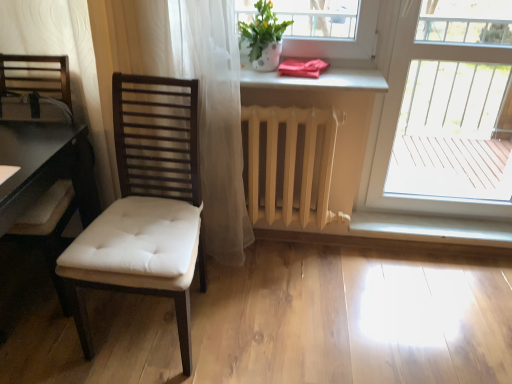
Question: Is white glossy window sill at lower center further to the viewer compared to white matte radiator at center?

Choices:
 (A) yes
 (B) no

Answer: (A)

Question: Can you confirm if white glossy window sill at lower center is positioned to the left of white matte radiator at center?

Choices:
 (A) yes
 (B) no

Answer: (B)

Question: Can we say white glossy window sill at lower center lies outside white matte radiator at center?

Choices:
 (A) no
 (B) yes

Answer: (B)

Question: From a real-world perspective, is white glossy window sill at lower center below white matte radiator at center?

Choices:
 (A) no
 (B) yes

Answer: (B)

Question: Does white glossy window sill at lower center have a greater height compared to white matte radiator at center?

Choices:
 (A) yes
 (B) no

Answer: (B)

Question: Considering the positions of transparent glass door at right and white glossy window sill at lower center in the image, is transparent glass door at right bigger or smaller than white glossy window sill at lower center?

Choices:
 (A) small
 (B) big

Answer: (B)

Question: Is transparent glass door at right inside the boundaries of white glossy window sill at lower center, or outside?

Choices:
 (A) inside
 (B) outside

Answer: (B)

Question: From a real-world perspective, is transparent glass door at right positioned above or below white glossy window sill at lower center?

Choices:
 (A) above
 (B) below

Answer: (A)

Question: Is transparent glass door at right to the left or to the right of white glossy window sill at lower center in the image?

Choices:
 (A) left
 (B) right

Answer: (B)

Question: In terms of width, does white matte radiator at center look wider or thinner when compared to white glossy window sill at lower center?

Choices:
 (A) wide
 (B) thin

Answer: (B)

Question: Is white matte radiator at center taller or shorter than white glossy window sill at lower center?

Choices:
 (A) tall
 (B) short

Answer: (A)

Question: Visually, is white matte radiator at center positioned to the left or to the right of white glossy window sill at lower center?

Choices:
 (A) right
 (B) left

Answer: (B)

Question: Based on their sizes in the image, would you say white matte radiator at center is bigger or smaller than white glossy window sill at lower center?

Choices:
 (A) big
 (B) small

Answer: (A)

Question: From their relative heights in the image, would you say white matte radiator at center is taller or shorter than matte white pot at upper center?

Choices:
 (A) short
 (B) tall

Answer: (B)

Question: From a real-world perspective, is white matte radiator at center above or below matte white pot at upper center?

Choices:
 (A) below
 (B) above

Answer: (A)